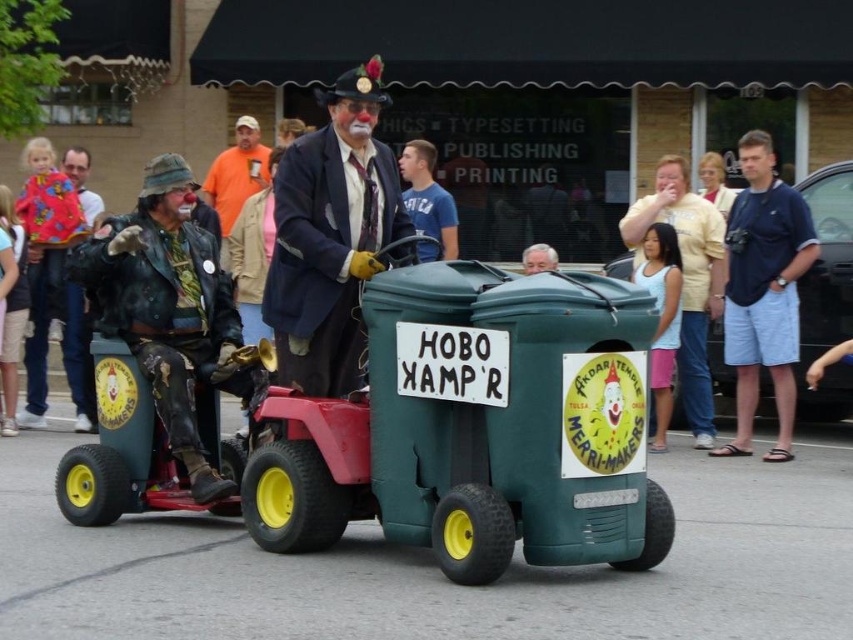
Question: In this image, where is light yellow shirt at center located relative to smooth skin face at center?

Choices:
 (A) right
 (B) left

Answer: (A)

Question: Where is light yellow shirt at center located in relation to smooth skin face at center in the image?

Choices:
 (A) left
 (B) right

Answer: (B)

Question: Which point is closer to the camera taking this photo?

Choices:
 (A) (229, 193)
 (B) (772, 189)
 (C) (161, 344)
 (D) (643, 211)

Answer: (C)

Question: Which point appears closest to the camera in this image?

Choices:
 (A) (550, 252)
 (B) (746, 218)
 (C) (291, 172)
 (D) (207, 180)

Answer: (C)

Question: Estimate the real-world distances between objects in this image. Which object is closer to the blue denim shorts at right?

Choices:
 (A) matte black suit at center
 (B) orange fabric shirt at upper center
 (C) light yellow shirt at center
 (D) leather jacket at left

Answer: (C)

Question: Where is matte black suit at center located in relation to blue denim shorts at right in the image?

Choices:
 (A) left
 (B) right

Answer: (A)